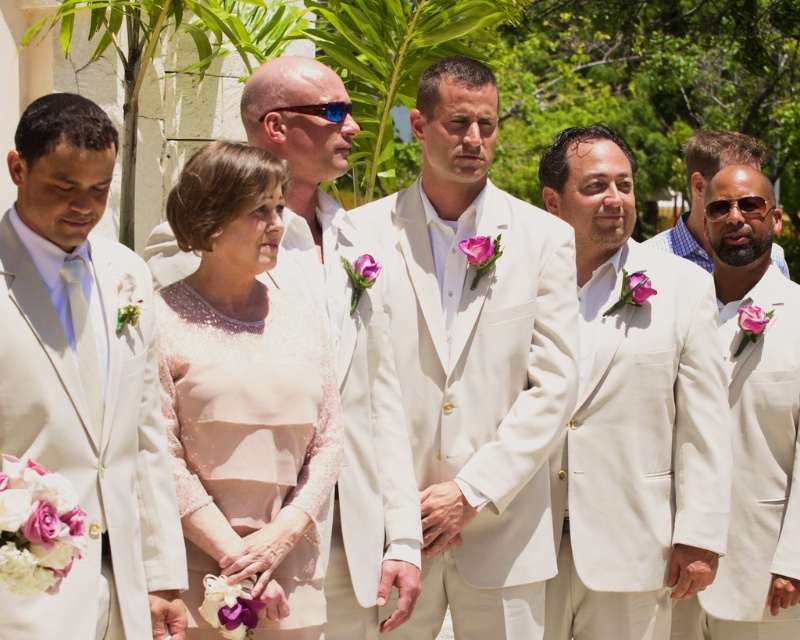
You are a photographer at a formal event and need to arrange two subjects wearing the matte white suit at center and the white satin suit at center. According to the scene, which suit is on the right side when facing the subjects?

The matte white suit at center is positioned on the right side of the white satin suit at center, so when facing the subjects, the matte white suit at center is on the right.

You are a photographer at a formal event and need to adjust the lighting to ensure both the matte white suit at left and the matte white suit at center are well lit. Based on their positions, which suit might require more adjustment to avoid being overshadowed?

The matte white suit at left is positioned over the matte white suit at center, so the suit at center might be in shadow and require more lighting adjustments to ensure it is properly illuminated.